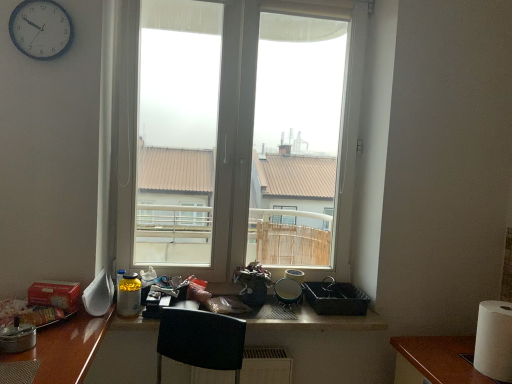
Question: Is white glossy spoon at left, which appears as the second appliance when viewed from the front, wider or thinner than white paper at right?

Choices:
 (A) wide
 (B) thin

Answer: (B)

Question: From their relative heights in the image, would you say white glossy spoon at left, which appears as the second appliance when viewed from the front, is taller or shorter than white paper at right?

Choices:
 (A) short
 (B) tall

Answer: (A)

Question: Estimate the real-world distances between objects in this image. Which object is closer to the white paper at right?

Choices:
 (A) translucent plastic bottle at lower left
 (B) transparent glass window at center
 (C) white plastic clock at upper left
 (D) metallic silver frying pan at center, which is the 2th appliance from right to left
 (E) metallic silver pot at left, the 1th appliance viewed from the left

Answer: (D)

Question: Which of these objects is positioned closest to the transparent glass window at center?

Choices:
 (A) black woven basket at lower right, which is counted as the 1th appliance, starting from the right
 (B) translucent plastic bottle at lower left
 (C) white plastic clock at upper left
 (D) white glossy spoon at left, the 3th appliance from the back
 (E) metallic silver frying pan at center, which is counted as the second appliance, starting from the back

Answer: (A)